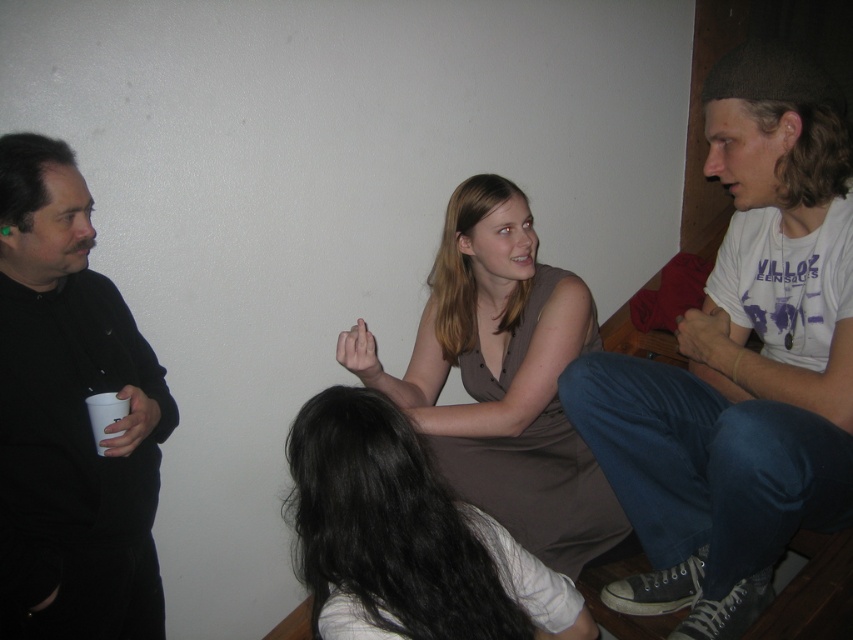
Between black matte shirt at left and smooth brown dress at center, which one has more height?

black matte shirt at left

Between point (56, 448) and point (328, 627), which one is positioned behind?

The point (56, 448) is behind.

Who is more distant from viewer, (44, 554) or (444, 502)?

The point (44, 554) is behind.

I want to click on black matte shirt at left, so click(70, 419).

Is white cotton t-shirt at upper right to the right of black matte shirt at left from the viewer's perspective?

Correct, you'll find white cotton t-shirt at upper right to the right of black matte shirt at left.

Which is below, white cotton t-shirt at upper right or black matte shirt at left?

black matte shirt at left

Locate an element on the screen. The image size is (853, 640). white cotton t-shirt at upper right is located at coordinates (740, 362).

The image size is (853, 640). I want to click on white cotton t-shirt at upper right, so click(x=740, y=362).

Which is in front, point (22, 173) or point (480, 472)?

Point (22, 173) is more forward.

Based on the photo, is black matte shirt at left thinner than brown matte dress at center?

Yes, black matte shirt at left is thinner than brown matte dress at center.

Which is in front, point (102, 276) or point (445, 467)?

Point (102, 276)

Locate an element on the screen. This screenshot has height=640, width=853. black matte shirt at left is located at coordinates (70, 419).